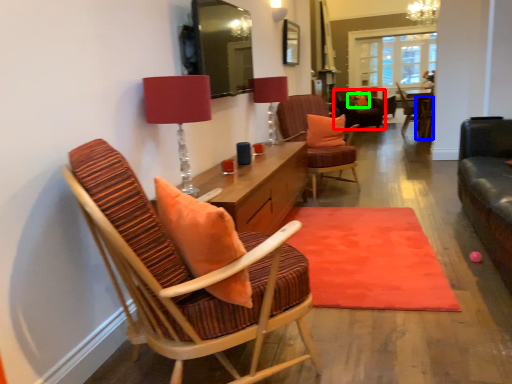
Question: Based on their relative distances, which object is nearer to chair (highlighted by a red box)? Choose from chair (highlighted by a blue box) and pillow (highlighted by a green box).

Choices:
 (A) chair
 (B) pillow

Answer: (B)